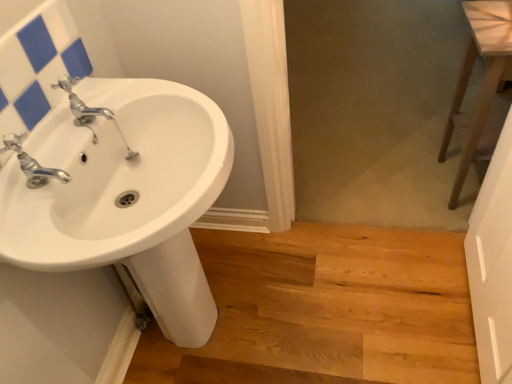
Locate an element on the screen. vacant space that is to the left of transparent glass screen door at right is located at coordinates (366, 326).